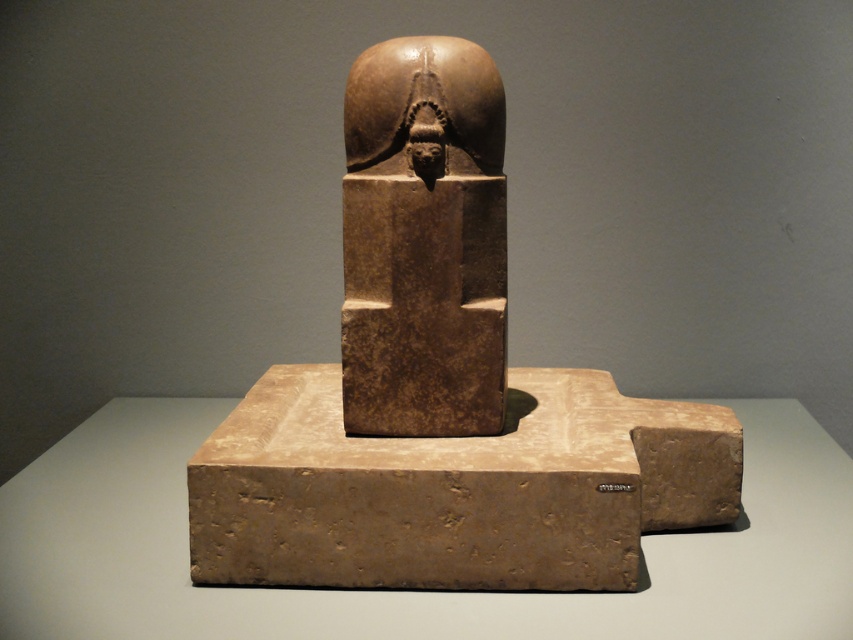
You are a museum curator planning to install a protective glass case around the brown stone sculpture at center and the brown stone head at center. The glass case has a height limit of 2 meters. Can both objects fit inside the case without exceeding the height limit?

The brown stone sculpture at center is taller than the brown stone head at center. Since the glass case has a height limit of 2 meters, both objects can fit inside the case as long as the tallest object, the brown stone sculpture at center, is under 2 meters in height. However, the exact dimensions are not provided, so this depends on the sculpture meeting the height requirement.

You are a museum visitor standing in front of the exhibit. You want to take a photo of the brown stone statue at center. Where should you position yourself to ensure the statue is centered in your camera frame?

To center the brown stone statue at center in your camera frame, position yourself directly in front of the statue at the coordinates corresponding to its 2D location at point [422,241].